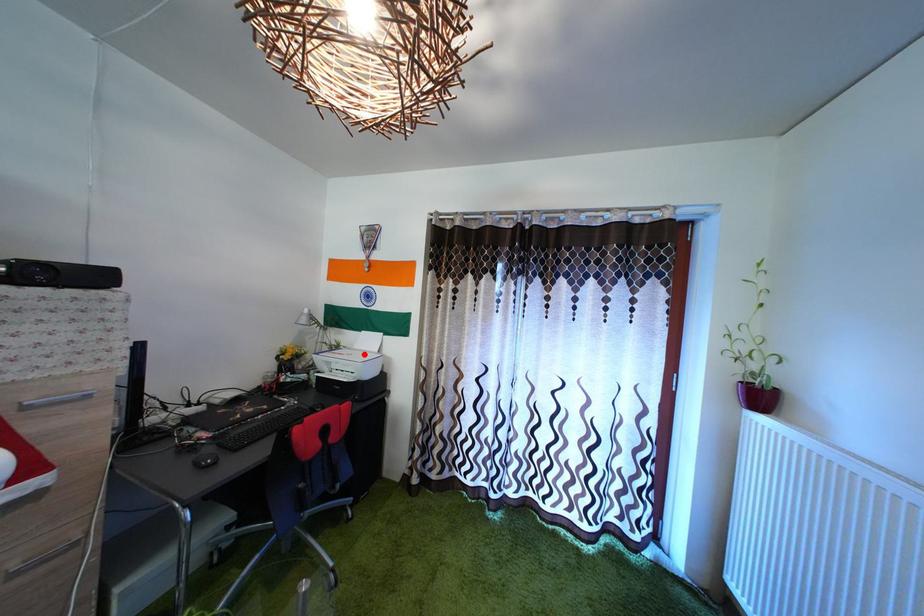
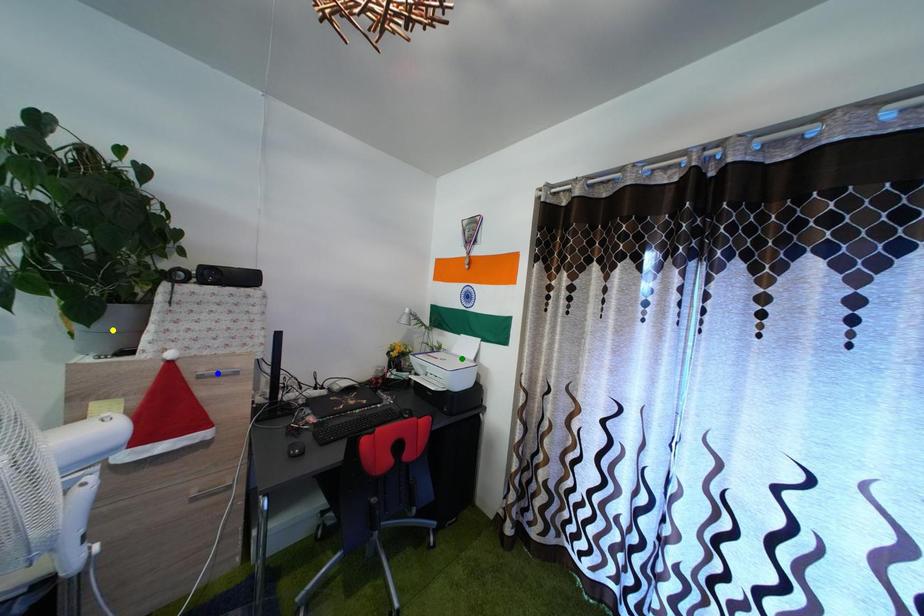
Question: I am providing you with two images of the same scene from different viewpoints. A red point is marked on the first image. You are given multiple points on the second image. Which spot in image 2 lines up with the point in image 1?

Choices:
 (A) yellow point
 (B) green point
 (C) blue point

Answer: (B)